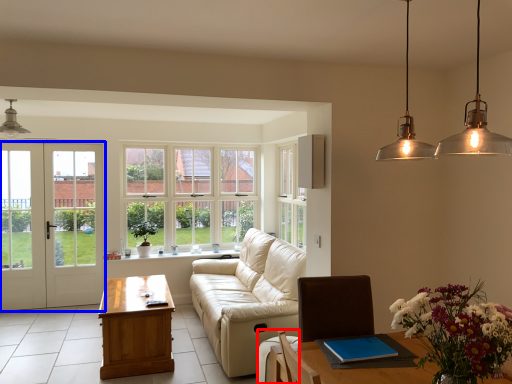
Question: Which object appears closest to the camera in this image, armchair (highlighted by a red box) or door (highlighted by a blue box)?

Choices:
 (A) armchair
 (B) door

Answer: (A)